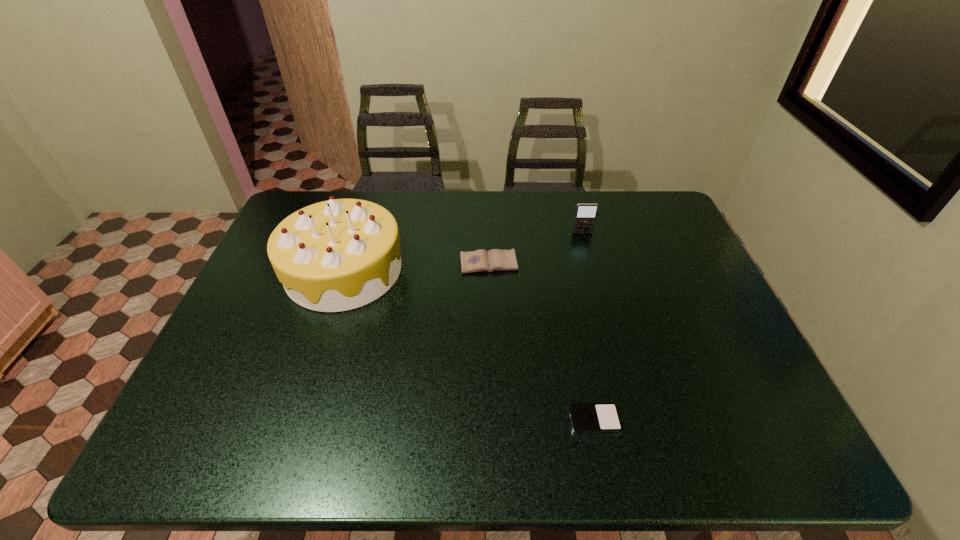
Where is `blank space located on the front of the diary`? blank space located on the front of the diary is located at coordinates (491, 323).

This screenshot has width=960, height=540. Find the location of `free space located 0.130m on the left of the shortest object`. free space located 0.130m on the left of the shortest object is located at coordinates (511, 419).

Where is `object that is at the far edge`? object that is at the far edge is located at coordinates (585, 215).

I want to click on object present at the near edge, so click(x=585, y=417).

Identify the location of object that is positioned at the left edge. tap(340, 254).

The height and width of the screenshot is (540, 960). In the image, there is a desktop. Find the location of `vacant space at the far edge`. vacant space at the far edge is located at coordinates (437, 216).

Find the location of a particular element. This screenshot has width=960, height=540. free space at the near edge is located at coordinates click(x=278, y=454).

In the image, there is a desktop. Where is `free space at the left edge`? The height and width of the screenshot is (540, 960). free space at the left edge is located at coordinates (247, 295).

You are a GUI agent. You are given a task and a screenshot of the screen. Output one action in this format:
    pyautogui.click(x=<x>, y=<y>)
    Task: Click on the vacant space at the right edge of the desktop
    The width and height of the screenshot is (960, 540).
    Given the screenshot: What is the action you would take?
    pyautogui.click(x=701, y=285)

In the image, there is a desktop. Identify the location of free region at the far left corner. (317, 195).